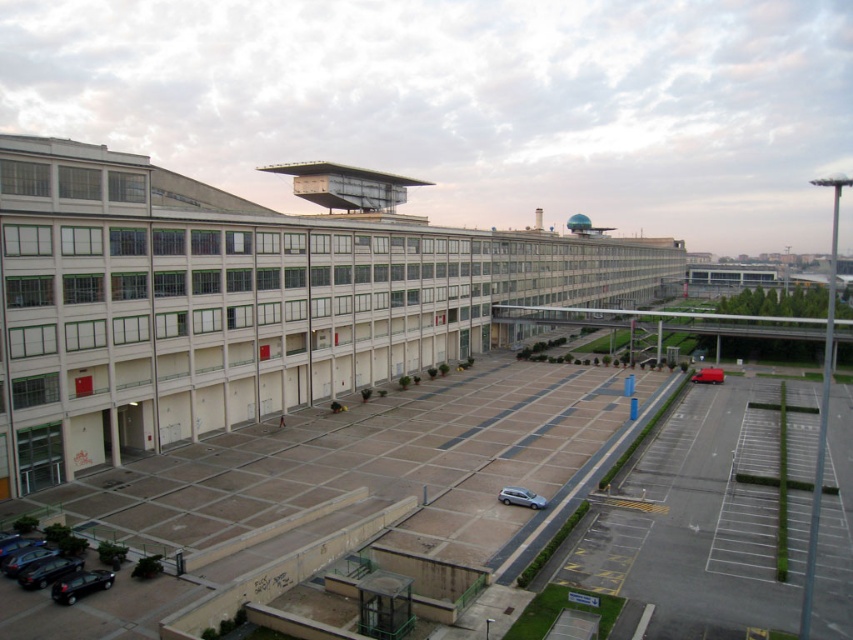
Is point (407, 291) closer to camera compared to point (97, 588)?

No, it is behind (97, 588).

Can you confirm if white concrete parking garage at center is positioned above shiny black car at lower left?

Correct, white concrete parking garage at center is located above shiny black car at lower left.

Is point (190, 404) in front of point (85, 576)?

That is False.

The image size is (853, 640). What are the coordinates of `white concrete parking garage at center` in the screenshot? It's located at (239, 301).

Which is in front, point (67, 600) or point (697, 371)?

Positioned in front is point (67, 600).

Does shiny black car at lower left have a lesser height compared to matte red van at lower right?

Correct, shiny black car at lower left is not as tall as matte red van at lower right.

Image resolution: width=853 pixels, height=640 pixels. I want to click on shiny black car at lower left, so click(80, 584).

Is satin silver car at center behind matte red van at lower right?

No.

Does point (532, 508) come closer to viewer compared to point (708, 380)?

Yes, point (532, 508) is in front of point (708, 380).

Measure the distance between point (511, 497) and camera.

The distance of point (511, 497) from camera is 167.14 feet.

Find the location of a particular element. This screenshot has width=853, height=640. satin silver car at center is located at coordinates (520, 497).